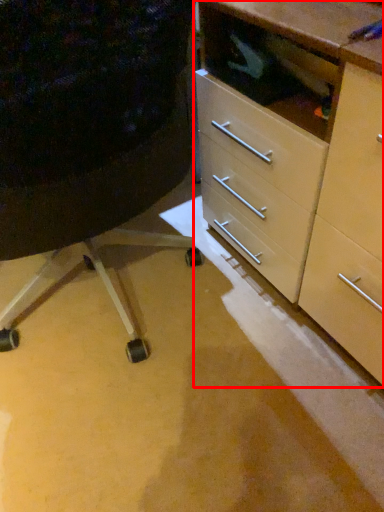
Question: Observing the image, what is the correct spatial positioning of chest of drawers (annotated by the red box) in reference to furniture?

Choices:
 (A) left
 (B) right

Answer: (B)